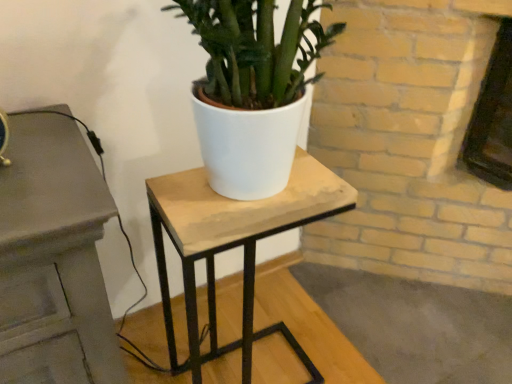
Question: From a real-world perspective, is white matte pot at center physically below wooden table at center?

Choices:
 (A) yes
 (B) no

Answer: (B)

Question: Is white matte pot at center turned away from wooden table at center?

Choices:
 (A) yes
 (B) no

Answer: (B)

Question: Does white matte pot at center contain wooden table at center?

Choices:
 (A) no
 (B) yes

Answer: (A)

Question: Is white matte pot at center outside of wooden table at center?

Choices:
 (A) no
 (B) yes

Answer: (B)

Question: Can you confirm if white matte pot at center is positioned to the right of wooden table at center?

Choices:
 (A) no
 (B) yes

Answer: (B)

Question: Does white matte pot at center come behind wooden table at center?

Choices:
 (A) yes
 (B) no

Answer: (B)

Question: Does wooden table at center have a larger size compared to white matte pot at center?

Choices:
 (A) yes
 (B) no

Answer: (A)

Question: From a real-world perspective, is wooden table at center positioned over white matte pot at center based on gravity?

Choices:
 (A) no
 (B) yes

Answer: (A)

Question: Is wooden table at center oriented away from white matte pot at center?

Choices:
 (A) no
 (B) yes

Answer: (A)

Question: From the image's perspective, is wooden table at center located beneath white matte pot at center?

Choices:
 (A) yes
 (B) no

Answer: (A)

Question: From the image's perspective, is wooden table at center on top of white matte pot at center?

Choices:
 (A) yes
 (B) no

Answer: (B)

Question: Does wooden table at center turn towards white matte pot at center?

Choices:
 (A) no
 (B) yes

Answer: (A)

Question: Looking at their shapes, would you say wooden table at center is wider or thinner than white matte pot at center?

Choices:
 (A) wide
 (B) thin

Answer: (A)